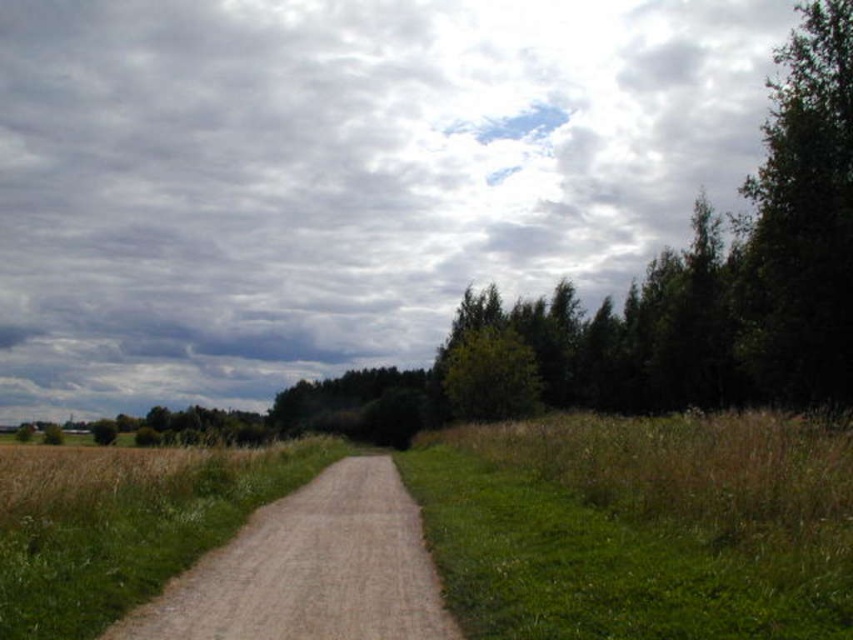
Can you confirm if green grassy at right is positioned to the right of dusty gravel path at center?

Correct, you'll find green grassy at right to the right of dusty gravel path at center.

Which is above, green grassy at right or dusty gravel path at center?

green grassy at right is higher up.

Find the location of a particular element. The height and width of the screenshot is (640, 853). green grassy at right is located at coordinates (625, 531).

What are the coordinates of `green grassy at right` in the screenshot? It's located at (625, 531).

Between dusty gravel path at center and green leafy tree at right, which one appears on the left side from the viewer's perspective?

dusty gravel path at center

Is the position of dusty gravel path at center more distant than that of green leafy tree at right?

No, dusty gravel path at center is in front of green leafy tree at right.

Which is behind, point (376, 620) or point (763, 308)?

Point (763, 308)

Find the location of a particular element. dusty gravel path at center is located at coordinates [310, 570].

Can you confirm if green grassy at right is taller than green leafy tree at right?

No.

The width and height of the screenshot is (853, 640). I want to click on green grassy at right, so click(x=625, y=531).

What are the coordinates of `green grassy at right` in the screenshot? It's located at (625, 531).